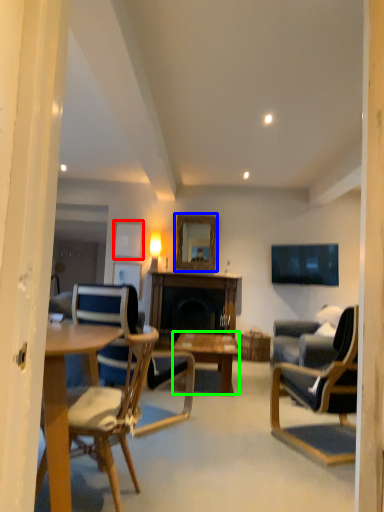
Question: Estimate the real-world distances between objects in this image. Which object is closer to picture frame (highlighted by a red box), mirror (highlighted by a blue box) or coffee table (highlighted by a green box)?

Choices:
 (A) mirror
 (B) coffee table

Answer: (A)